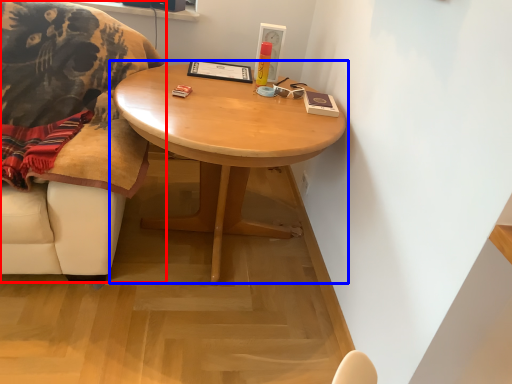
Question: Among these objects, which one is farthest to the camera, chair (highlighted by a red box) or coffee table (highlighted by a blue box)?

Choices:
 (A) chair
 (B) coffee table

Answer: (B)